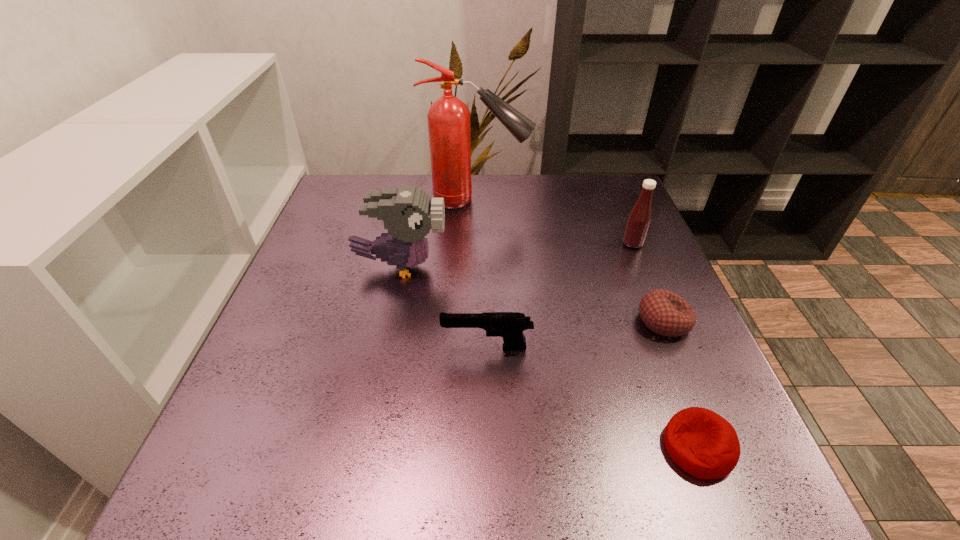
At what (x,y) coordinates should I click in order to perform the action: click on object that is positioned at the left edge. Please return your answer as a coordinate pair (x, y). The width and height of the screenshot is (960, 540). Looking at the image, I should click on (408, 213).

You are a GUI agent. You are given a task and a screenshot of the screen. Output one action in this format:
    pyautogui.click(x=<x>, y=<y>)
    Task: Click on the Tabasco sauce located in the right edge section of the desktop
    This screenshot has height=540, width=960.
    Given the screenshot: What is the action you would take?
    pyautogui.click(x=639, y=219)

Where is `object located in the near right corner section of the desktop`? The image size is (960, 540). object located in the near right corner section of the desktop is located at coordinates (701, 442).

Where is `vacant space at the far edge of the desktop`? This screenshot has height=540, width=960. vacant space at the far edge of the desktop is located at coordinates (522, 192).

Find the location of `vacant space at the near edge of the desktop`. vacant space at the near edge of the desktop is located at coordinates (621, 490).

This screenshot has height=540, width=960. What are the coordinates of `vacant area at the left edge of the desktop` in the screenshot? It's located at (244, 441).

At what (x,y) coordinates should I click in order to perform the action: click on free space at the right edge of the desktop. Please return your answer as a coordinate pair (x, y). The width and height of the screenshot is (960, 540). Looking at the image, I should click on (612, 256).

Locate an element on the screen. vacant space at the far right corner is located at coordinates (600, 203).

The height and width of the screenshot is (540, 960). What are the coordinates of `vacant area that lies between the fourth nearest object and the nearer beanbag` in the screenshot? It's located at (549, 357).

At what (x,y) coordinates should I click in order to perform the action: click on unoccupied position between the second nearest object and the nearer beanbag. Please return your answer as a coordinate pair (x, y). Image resolution: width=960 pixels, height=540 pixels. Looking at the image, I should click on (592, 397).